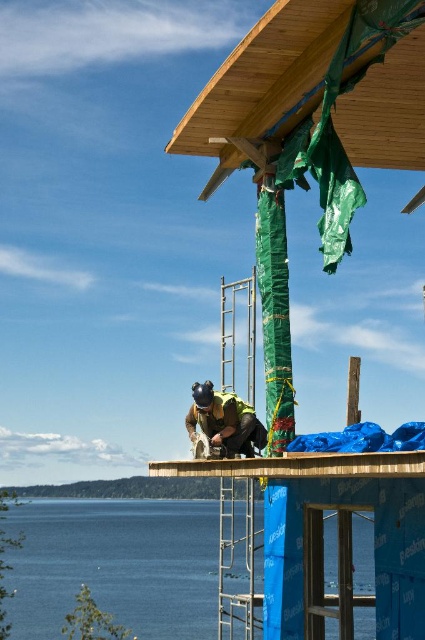
Question: Considering the real-world distances, which object is farthest from the green safety vest at center?

Choices:
 (A) blue water at lower left
 (B) natural wood roof at upper center

Answer: (A)

Question: Based on their relative distances, which object is farther from the green safety vest at center?

Choices:
 (A) natural wood roof at upper center
 (B) blue water at lower left

Answer: (B)

Question: Is natural wood roof at upper center positioned in front of green safety vest at center?

Choices:
 (A) yes
 (B) no

Answer: (A)

Question: Considering the relative positions of natural wood roof at upper center and green safety vest at center in the image provided, where is natural wood roof at upper center located with respect to green safety vest at center?

Choices:
 (A) right
 (B) left

Answer: (A)

Question: Does natural wood roof at upper center appear on the right side of green safety vest at center?

Choices:
 (A) yes
 (B) no

Answer: (A)

Question: Estimate the real-world distances between objects in this image. Which object is closer to the green safety vest at center?

Choices:
 (A) blue water at lower left
 (B) natural wood roof at upper center

Answer: (B)